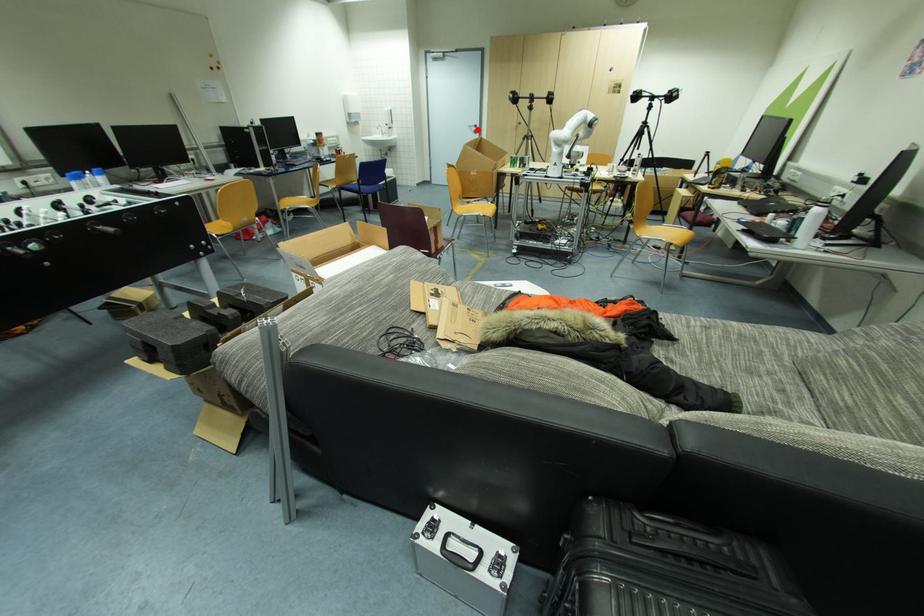
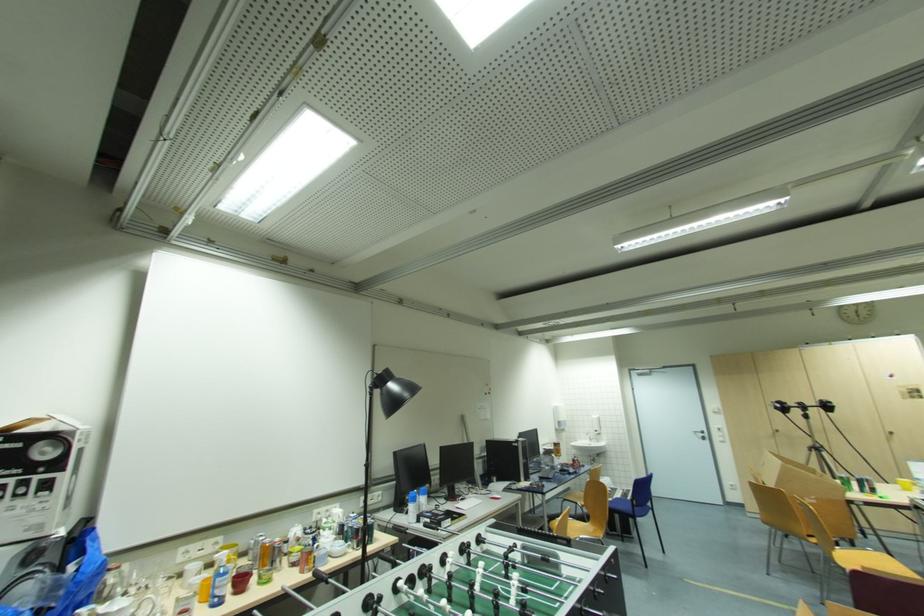
Question: I am providing you with two images of the same scene from different viewpoints. Image1 has a red point marked. In image2, the corresponding 3D location appears at what relative position? Reply with the corresponding letter.

Choices:
 (A) Closer
 (B) Farther

Answer: (B)